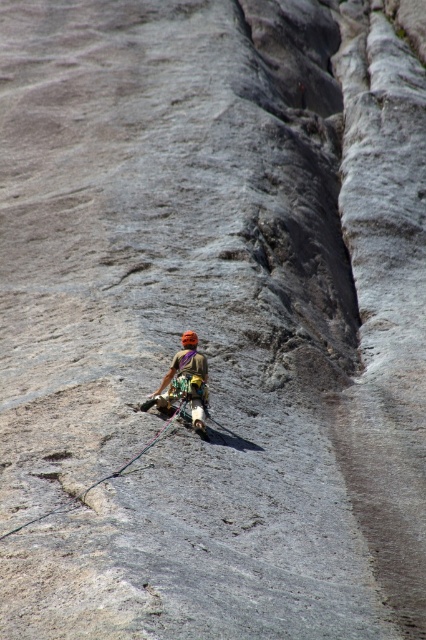
Can you confirm if matte orange helmet at center is taller than black nylon rope at center?

Yes, matte orange helmet at center is taller than black nylon rope at center.

The height and width of the screenshot is (640, 426). Identify the location of matte orange helmet at center. (184, 384).

The image size is (426, 640). I want to click on matte orange helmet at center, so click(184, 384).